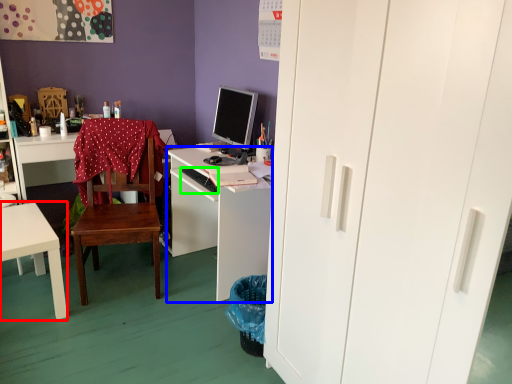
Question: Considering the real-world distances, which object is farthest from desk (highlighted by a red box)? desk (highlighted by a blue box) or computer keyboard (highlighted by a green box)?

Choices:
 (A) desk
 (B) computer keyboard

Answer: (B)